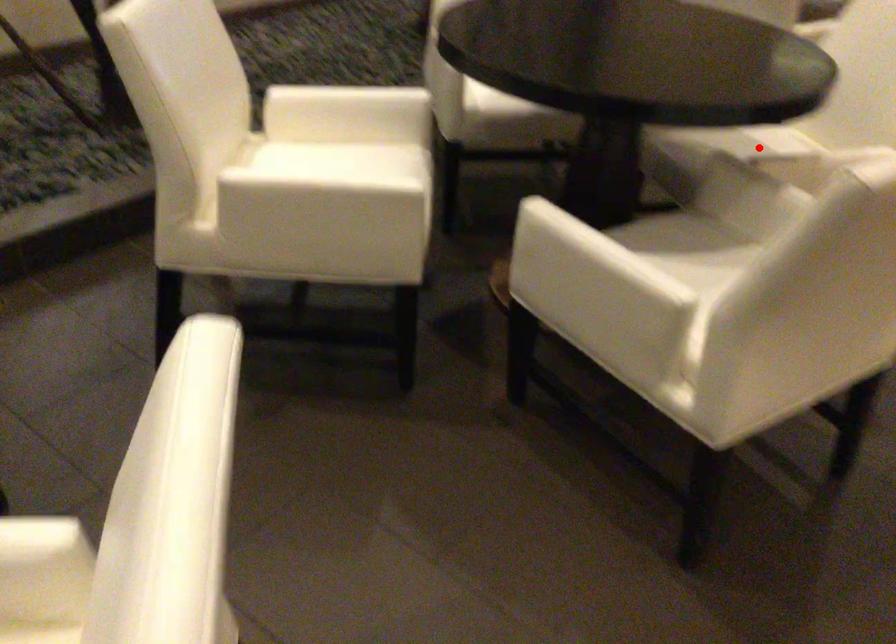
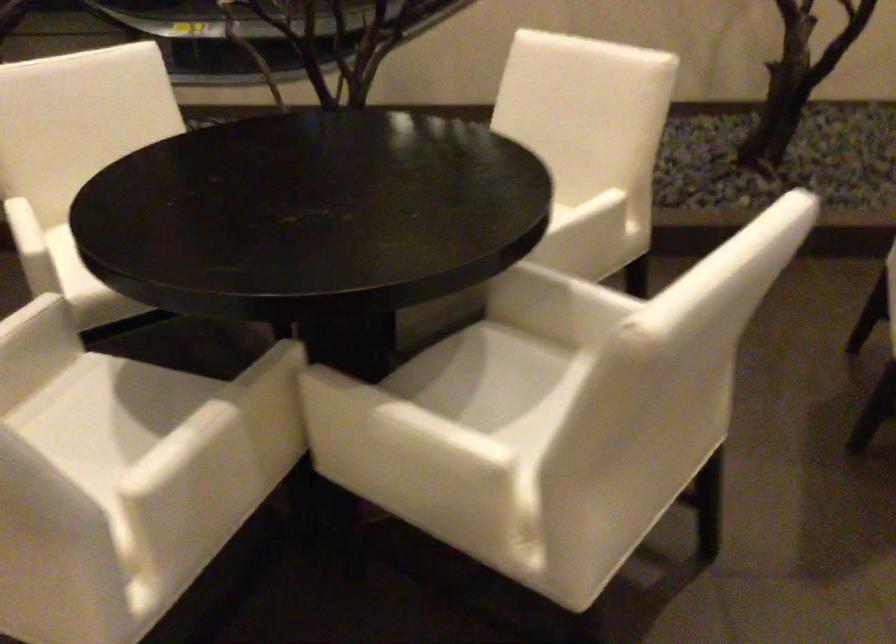
Question: I am providing you with two images of the same scene from different viewpoints. Image1 has a red point marked. In image2, the corresponding 3D location appears at what relative position? Reply with the corresponding letter.

Choices:
 (A) Closer
 (B) Farther

Answer: (A)